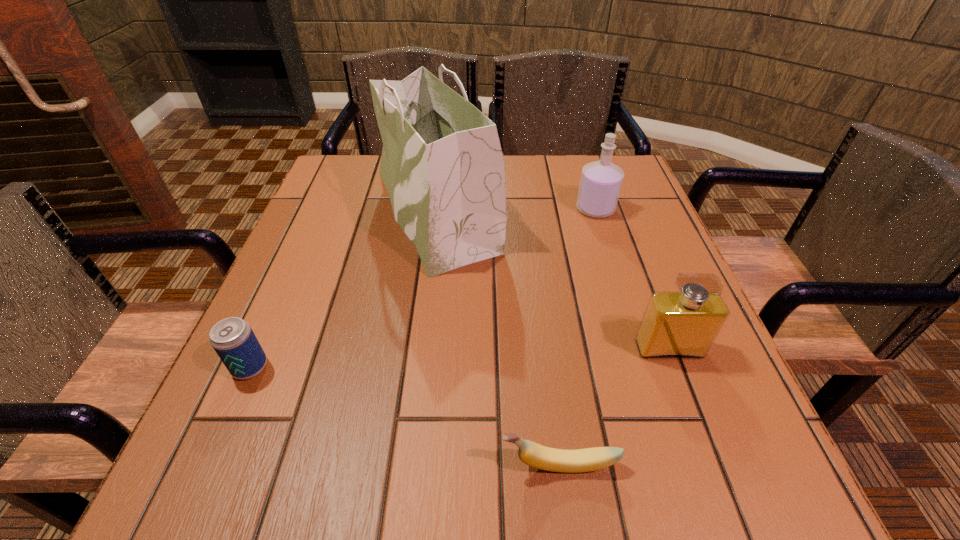
Image resolution: width=960 pixels, height=540 pixels. What are the coordinates of `vacant region located 0.170m on the front of the fourth tallest object` in the screenshot? It's located at (195, 490).

Locate an element on the screen. free space located 0.340m at the stem of the banana is located at coordinates (260, 464).

You are a GUI agent. You are given a task and a screenshot of the screen. Output one action in this format:
    pyautogui.click(x=<x>, y=<y>)
    Task: Click on the free space located at the stem of the banana
    
    Given the screenshot: What is the action you would take?
    pyautogui.click(x=401, y=464)

The height and width of the screenshot is (540, 960). I want to click on free space located 0.140m at the stem of the banana, so click(401, 464).

Find the location of a particular element. The image size is (960, 540). grocery bag that is positioned at the far edge is located at coordinates (442, 164).

This screenshot has height=540, width=960. I want to click on perfume that is at the far edge, so click(x=600, y=184).

I want to click on object that is positioned at the near edge, so click(x=535, y=455).

Where is `grocery bag that is at the left edge`? grocery bag that is at the left edge is located at coordinates (442, 164).

Where is `beer can located at the left edge`? The height and width of the screenshot is (540, 960). beer can located at the left edge is located at coordinates (233, 339).

This screenshot has width=960, height=540. I want to click on object that is at the far left corner, so click(442, 164).